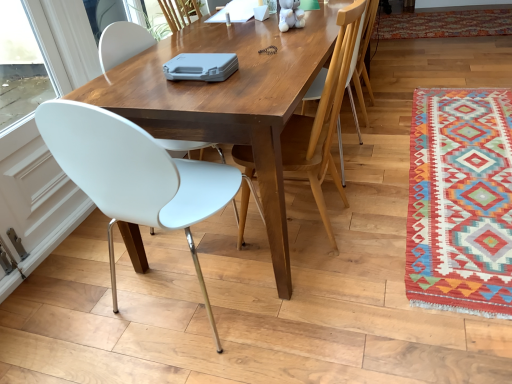
Question: From a real-world perspective, is wooden chair at upper right, marked as the first chair in a right-to-left arrangement, over multicolored woven rug at lower right, which appears as the second mat when viewed from the back?

Choices:
 (A) yes
 (B) no

Answer: (A)

Question: Can we say wooden chair at upper right, marked as the first chair in a right-to-left arrangement, lies outside multicolored woven rug at lower right, which appears as the second mat when viewed from the back?

Choices:
 (A) no
 (B) yes

Answer: (B)

Question: From the image's perspective, is wooden chair at upper right, the 3th chair in the left-to-right sequence, located above multicolored woven rug at lower right, which appears as the second mat when viewed from the back?

Choices:
 (A) no
 (B) yes

Answer: (B)

Question: Is wooden chair at upper right, marked as the first chair in a right-to-left arrangement, facing towards multicolored woven rug at lower right, which appears as the second mat when viewed from the back?

Choices:
 (A) no
 (B) yes

Answer: (A)

Question: Considering the relative positions of wooden chair at upper right, marked as the first chair in a right-to-left arrangement, and multicolored woven rug at lower right, which appears as the second mat when viewed from the back, in the image provided, is wooden chair at upper right, marked as the first chair in a right-to-left arrangement, to the right of multicolored woven rug at lower right, which appears as the second mat when viewed from the back, from the viewer's perspective?

Choices:
 (A) no
 (B) yes

Answer: (A)

Question: Does point (305, 41) appear closer or farther from the camera than point (334, 248)?

Choices:
 (A) farther
 (B) closer

Answer: (B)

Question: Would you say wooden table at center is to the left or to the right of white plastic chair at center, placed as the 2th chair when sorted from right to left, in the picture?

Choices:
 (A) right
 (B) left

Answer: (B)

Question: From the image's perspective, is wooden table at center above or below white plastic chair at center, placed as the second chair when sorted from left to right?

Choices:
 (A) above
 (B) below

Answer: (A)

Question: From a real-world perspective, is wooden table at center positioned above or below white plastic chair at center, placed as the 2th chair when sorted from right to left?

Choices:
 (A) below
 (B) above

Answer: (A)

Question: Is wooden chair at upper right, the 3th chair in the left-to-right sequence, in front of or behind white plastic chair at left, the first chair when ordered from left to right, in the image?

Choices:
 (A) behind
 (B) front

Answer: (A)

Question: Looking at their shapes, would you say wooden chair at upper right, marked as the first chair in a right-to-left arrangement, is wider or thinner than white plastic chair at left, which is the 3th chair in right-to-left order?

Choices:
 (A) wide
 (B) thin

Answer: (B)

Question: From a real-world perspective, is wooden chair at upper right, the 3th chair in the left-to-right sequence, above or below white plastic chair at left, the first chair when ordered from left to right?

Choices:
 (A) below
 (B) above

Answer: (A)

Question: Considering the positions of point (358, 125) and point (111, 211), is point (358, 125) closer or farther from the camera than point (111, 211)?

Choices:
 (A) closer
 (B) farther

Answer: (B)

Question: From a real-world perspective, is multicolored woven rug at right, the 2th mat viewed from the front, above or below wooden chair at upper right, marked as the first chair in a right-to-left arrangement?

Choices:
 (A) above
 (B) below

Answer: (B)

Question: Is multicolored woven rug at right, the 2th mat viewed from the front, to the left or to the right of wooden chair at upper right, marked as the first chair in a right-to-left arrangement, in the image?

Choices:
 (A) right
 (B) left

Answer: (A)